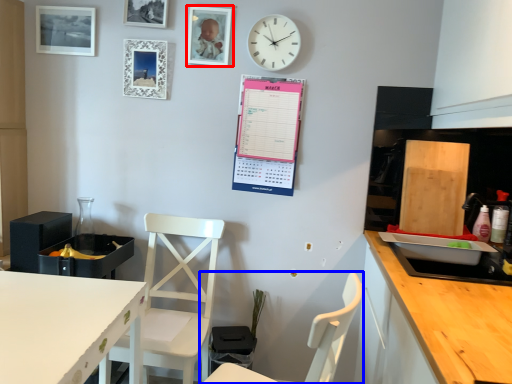
Question: Which object is closer to the camera taking this photo, picture frame (highlighted by a red box) or chair (highlighted by a blue box)?

Choices:
 (A) picture frame
 (B) chair

Answer: (B)